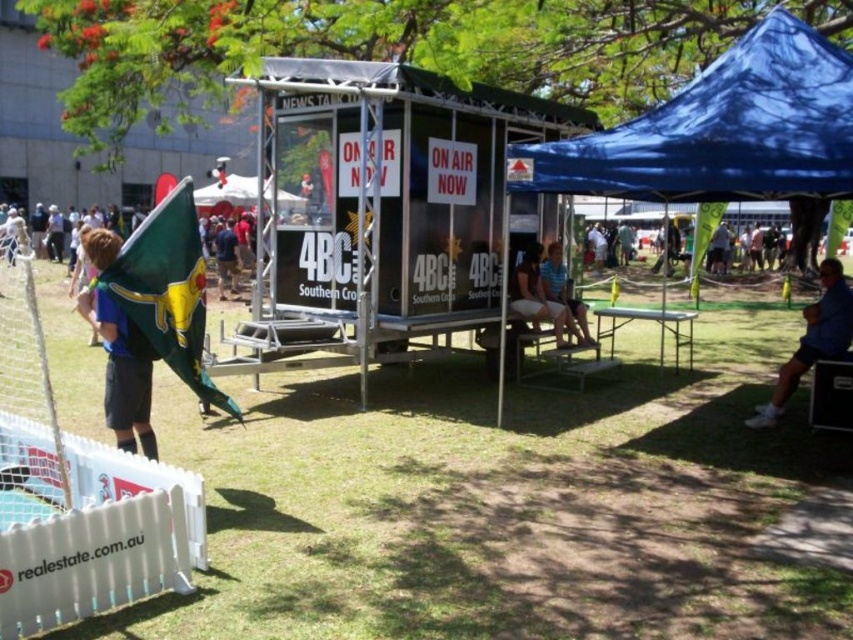
Question: Which object is the farthest from the blue jersey at left?

Choices:
 (A) white fabric canopy at upper center
 (B) blue fabric bag at lower right
 (C) blue fabric tent at upper right

Answer: (A)

Question: Is blue fabric canopy at upper right bigger than light brown wooden bench at center?

Choices:
 (A) no
 (B) yes

Answer: (B)

Question: Based on their relative distances, which object is nearer to the blue fabric tent at upper right?

Choices:
 (A) blue jersey at left
 (B) blue fabric bag at lower right
 (C) light brown wooden bench at center
 (D) blue fabric canopy at upper right

Answer: (D)

Question: Is blue fabric tent at upper right to the left of blue fabric canopy at upper right from the viewer's perspective?

Choices:
 (A) yes
 (B) no

Answer: (B)

Question: Is blue fabric canopy at upper right wider than light brown wooden bench at center?

Choices:
 (A) yes
 (B) no

Answer: (A)

Question: Among these points, which one is farthest from the camera?

Choices:
 (A) (813, 360)
 (B) (241, 177)
 (C) (117, 369)

Answer: (B)